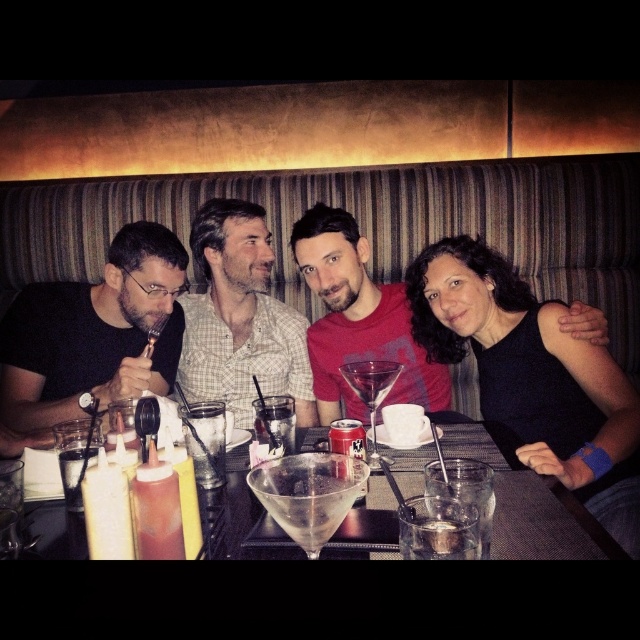
Looking at this image, you are at a bar and want to order a drink. The bartender asks you to choose between the clear glass cup at center and the clear glass at table center. Which one is wider?

The clear glass cup at center might be wider than clear glass at table center according to the description.

You are sitting at a table in a dimly lit restaurant. There are two points marked on the table. The first point is at coordinate point (70, 406) and the second point is at coordinate point (365, 369). If you were to move from the first point to the second point, would you be moving towards the front or the back of the table?

Moving from point (70, 406) to point (365, 369) would be moving towards the back of the table since point (70, 406) is behind point (365, 369).

You are a waiter in a restaurant. You see the image and need to place a new order for the person sitting at the position of point (93,332). Which person should you serve?

The point (93,332) corresponds to the black matte fork at left, so you should serve the first person from the left wearing glasses and a dark colored shirt.